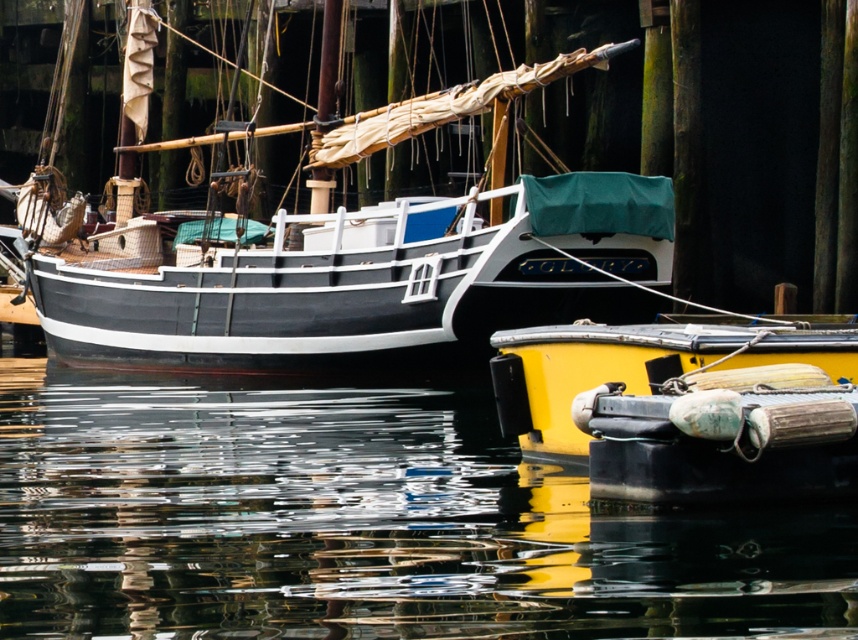
From the picture: You are standing at the wooden pier and want to walk to the smaller yellow boat. There are two points marked on the pier. One is at coordinates point (556, 269) and the other at point (554, 406). Which point is closer to the smaller yellow boat?

Point (554, 406) is closer to the smaller yellow boat because it is in front of point (556, 269), which is behind it.

From the picture: You are a photographer planning to take a photo of the harbor scene. You want to ensure both the matte black sailboat at upper left and the yellow matte buoy at lower right are clearly visible in the frame. Considering their sizes, which object might require you to adjust your camera angle to avoid it being too dominant in the shot?

The matte black sailboat at upper left is bigger than the yellow matte buoy at lower right, so adjusting the camera angle might be necessary to prevent the larger sailboat from overshadowing the smaller buoy in the photo.

You are standing on the wooden pier and want to throw a small floating toy into the water. Which object, the glossy water at lower center or the yellow matte buoy at lower right, is closer to you so that the toy can land safely?

The glossy water at lower center is closer to the viewer than the yellow matte buoy at lower right, so you should aim for the glossy water at lower center to ensure the toy lands safely.